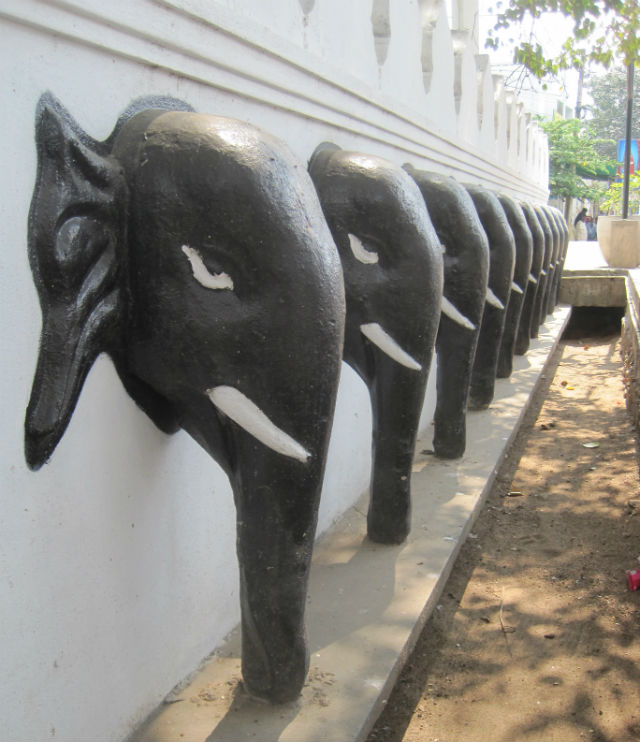
Find the location of a particular element. This screenshot has height=742, width=640. elephant statues is located at coordinates (301, 312).